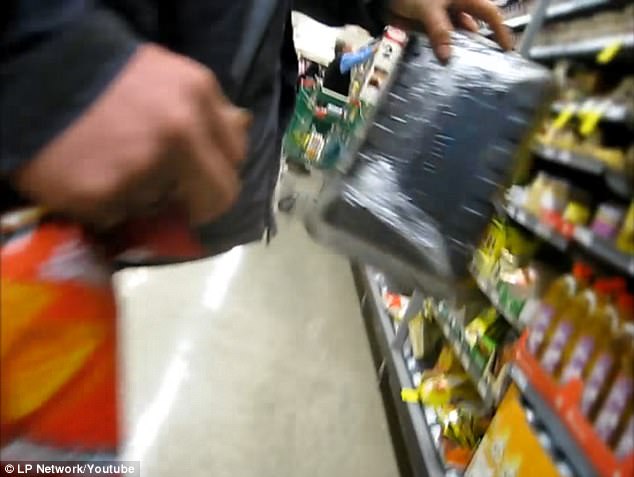
What are the coordinates of `shelf` in the screenshot? It's located at (398, 378), (458, 340), (499, 301), (534, 222), (572, 157), (605, 103).